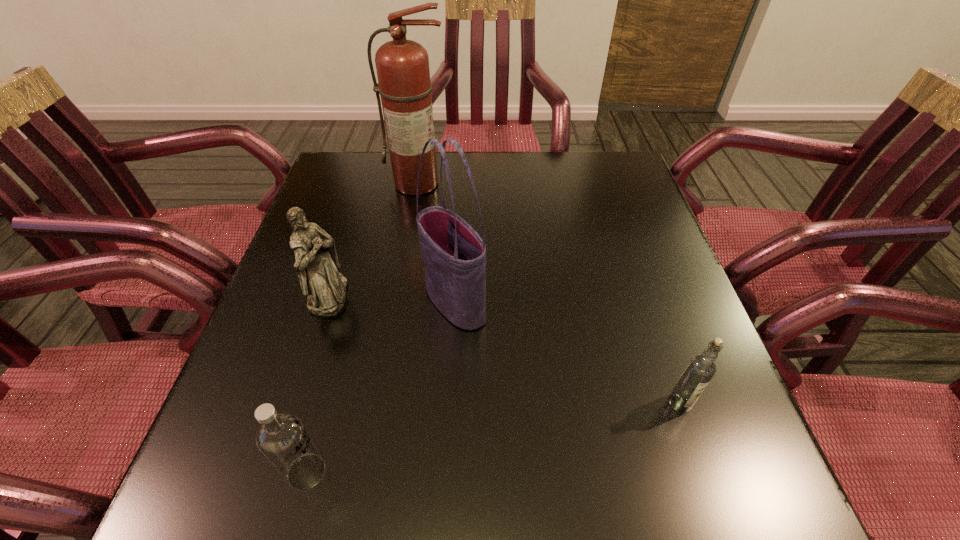
Locate an element on the screen. This screenshot has width=960, height=540. free region located on the front-facing side of the figurine is located at coordinates (532, 295).

Where is `blank space located on the front label of the nearest object`? blank space located on the front label of the nearest object is located at coordinates [x=466, y=472].

At what (x,y) coordinates should I click in order to perform the action: click on vacant space located on the label of the farther vodka. Please return your answer as a coordinate pair (x, y). This screenshot has width=960, height=540. Looking at the image, I should click on (701, 467).

In order to click on object positioned at the far edge in this screenshot , I will do `click(402, 66)`.

I want to click on object situated at the near edge, so click(x=282, y=438).

Locate an element on the screen. The width and height of the screenshot is (960, 540). figurine located at the left edge is located at coordinates (317, 265).

Where is `vodka that is at the left edge`? The image size is (960, 540). vodka that is at the left edge is located at coordinates (282, 438).

You are a GUI agent. You are given a task and a screenshot of the screen. Output one action in this format:
    pyautogui.click(x=<x>, y=<y>)
    Task: Click on the object at the right edge
    
    Given the screenshot: What is the action you would take?
    pyautogui.click(x=699, y=371)

The height and width of the screenshot is (540, 960). Find the location of `object that is at the near left corner`. object that is at the near left corner is located at coordinates (282, 438).

The image size is (960, 540). What are the coordinates of `vacant space at the far edge of the desktop` in the screenshot? It's located at (509, 181).